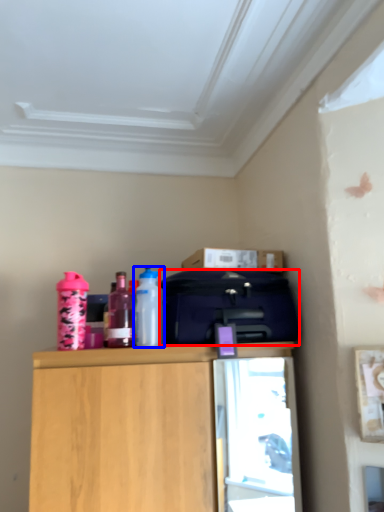
Question: Among these objects, which one is nearest to the camera, luggage (highlighted by a red box) or bottle (highlighted by a blue box)?

Choices:
 (A) luggage
 (B) bottle

Answer: (A)